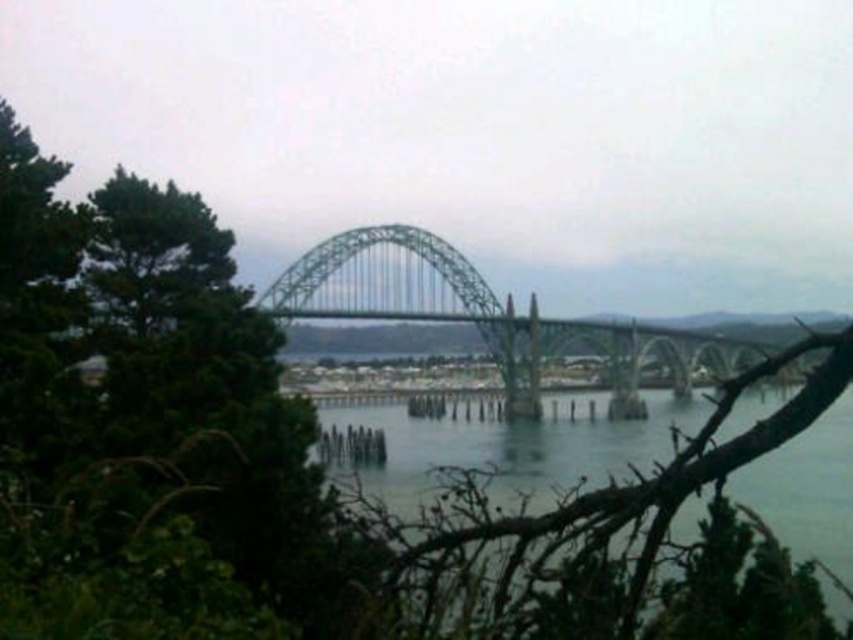
Between point (827, 476) and point (521, 356), which one is positioned in front?

Point (827, 476)

Who is positioned more to the left, clear water at center or green metallic bridge at center?

Positioned to the left is clear water at center.

Is point (846, 464) positioned in front of point (509, 294)?

Yes, point (846, 464) is in front of point (509, 294).

Locate an element on the screen. clear water at center is located at coordinates tap(515, 442).